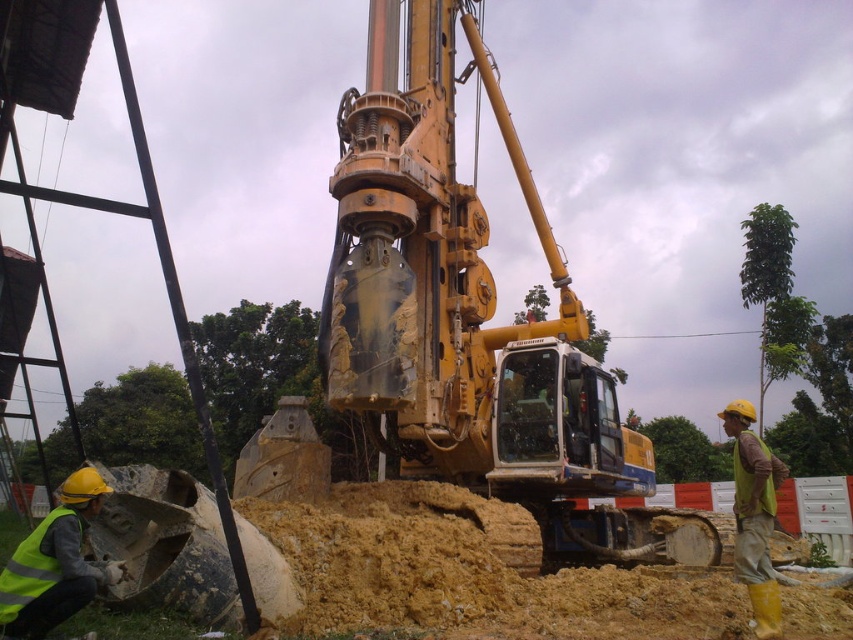
You are a safety inspector at the construction site. You need to ensure that the yellow metallic excavator at center and the yellow reflective vest at right are placed in a way that the smaller object is not obstructing the larger one. Based on the scene description, is the current placement compliant with safety regulations?

The yellow metallic excavator at center occupies less space than yellow reflective vest at right. Since the excavator is smaller, it should not obstruct the larger reflective vest area. The current placement complies with safety regulations as the smaller object is not blocking the larger one.

You are a safety inspector checking the visibility of safety gear on a construction site. You notice two reflective yellow vests in the scene. According to safety regulations, all vests must be at least 30 cm wide to ensure visibility. Can you determine if both reflective yellow vest at lower left and yellow reflective vest at right meet the minimum width requirement?

The reflective yellow vest at lower left has a width less than the yellow reflective vest at right. Since the minimum required width is 30 cm, but we don not have exact measurements for either vest, it is impossible to confirm if both meet the requirement based on the provided information.

You are a construction worker standing at the point with coordinates 0.494, 0.549. You need to locate the yellow metallic excavator at center. Is it directly in front of you?

Yes, the yellow metallic excavator at center is located exactly at your current position since the coordinates provided match your location.